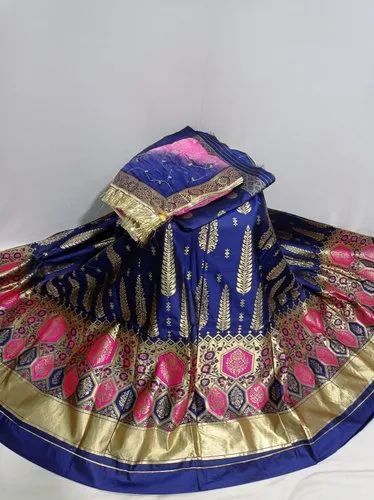
At what (x,y) coordinates should I click in order to perform the action: click on folded fabric. Please return your answer as a coordinate pair (x, y). Looking at the image, I should click on point(197,191).